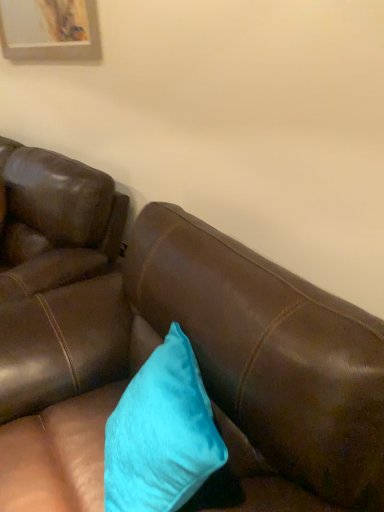
Question: From the image's perspective, relative to brown leather couch at center, is turquoise velvet pillow at center above or below?

Choices:
 (A) above
 (B) below

Answer: (A)

Question: Is turquoise velvet pillow at center inside the boundaries of brown leather couch at center, or outside?

Choices:
 (A) inside
 (B) outside

Answer: (A)

Question: From a real-world perspective, is turquoise velvet pillow at center above or below brown leather couch at center?

Choices:
 (A) above
 (B) below

Answer: (A)

Question: Considering the positions of brown leather couch at center and turquoise velvet pillow at center in the image, is brown leather couch at center bigger or smaller than turquoise velvet pillow at center?

Choices:
 (A) big
 (B) small

Answer: (A)

Question: Is brown leather couch at center to the left or to the right of turquoise velvet pillow at center in the image?

Choices:
 (A) left
 (B) right

Answer: (A)

Question: From their relative heights in the image, would you say brown leather couch at center is taller or shorter than turquoise velvet pillow at center?

Choices:
 (A) short
 (B) tall

Answer: (B)

Question: In terms of width, does brown leather couch at center look wider or thinner when compared to turquoise velvet pillow at center?

Choices:
 (A) thin
 (B) wide

Answer: (B)